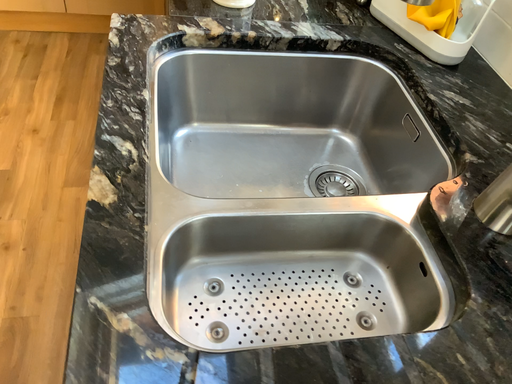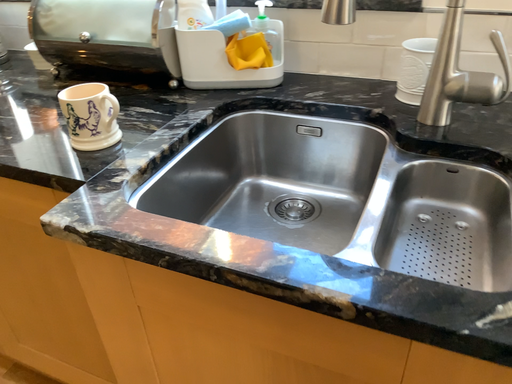
Question: How did the camera likely rotate when shooting the video?

Choices:
 (A) rotated upward
 (B) rotated downward

Answer: (A)